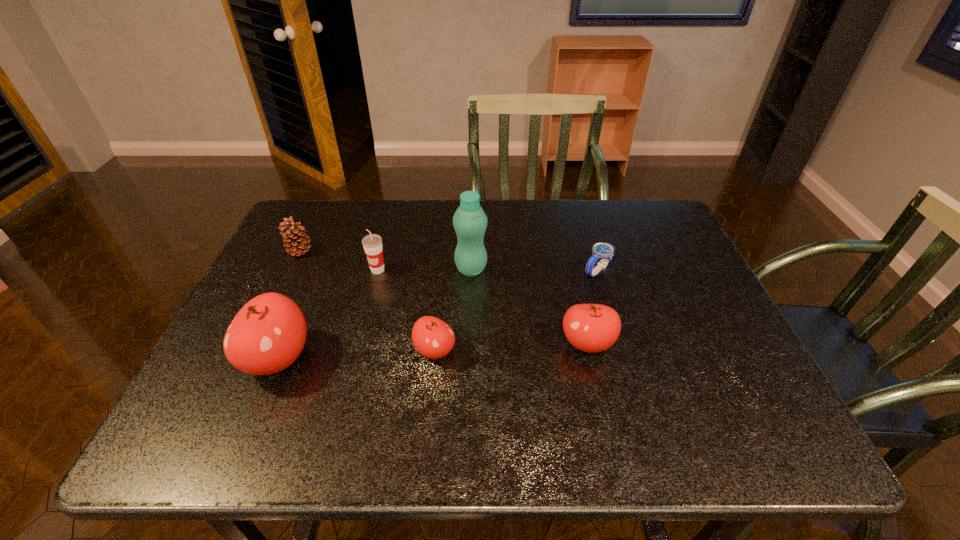
The height and width of the screenshot is (540, 960). I want to click on free point that keeps the apples evenly spaced on the right, so click(734, 336).